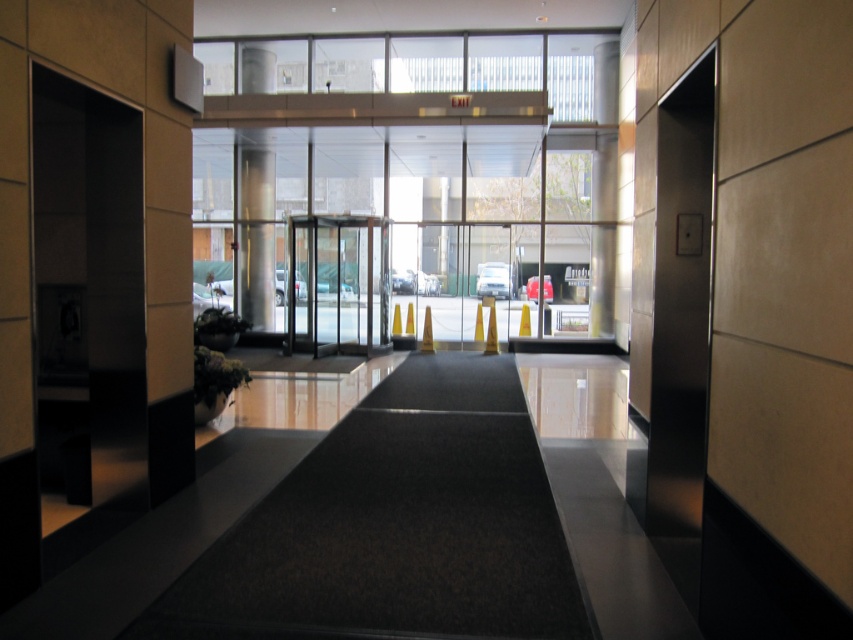
The image size is (853, 640). In order to click on transparent glass door at center in this screenshot , I will do `click(332, 284)`.

Between transparent glass door at center and metallic column at center, which one is positioned higher?

Positioned higher is metallic column at center.

Where is `transparent glass door at center`? This screenshot has width=853, height=640. transparent glass door at center is located at coordinates (332, 284).